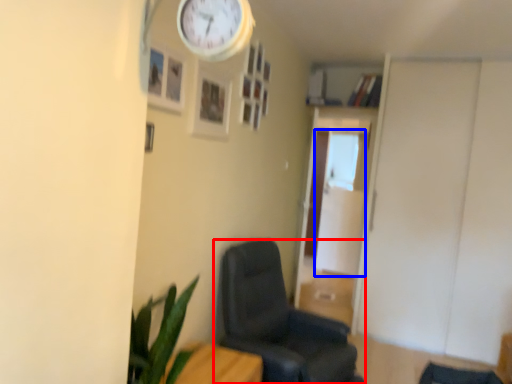
Question: Which point is further to the camera, chair (highlighted by a red box) or glass door (highlighted by a blue box)?

Choices:
 (A) chair
 (B) glass door

Answer: (B)